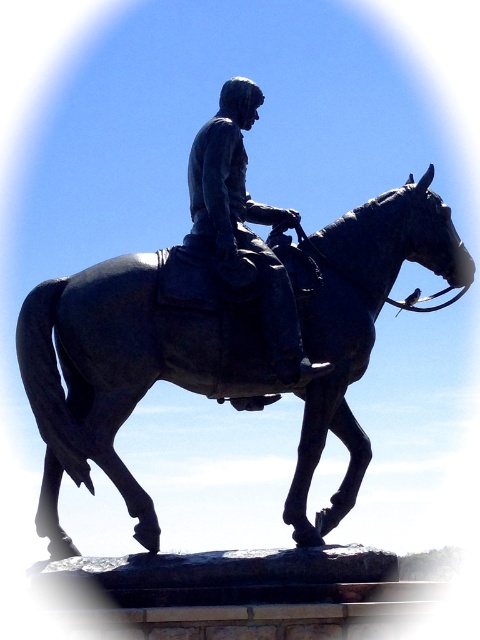
You are an art student analyzing the statue. You notice that the bronze statue of horse at center and the bronze statue at center are part of the same sculpture. Which one is positioned lower in the artwork?

The bronze statue of horse at center is positioned below bronze statue at center, so the bronze statue of horse at center is lower in the artwork.

You are an art student observing the bronze statue of horse at center and the bronze statue at center in the image. Which one is closer to you?

The bronze statue of horse at center is closer to you because it is in front of the bronze statue at center.